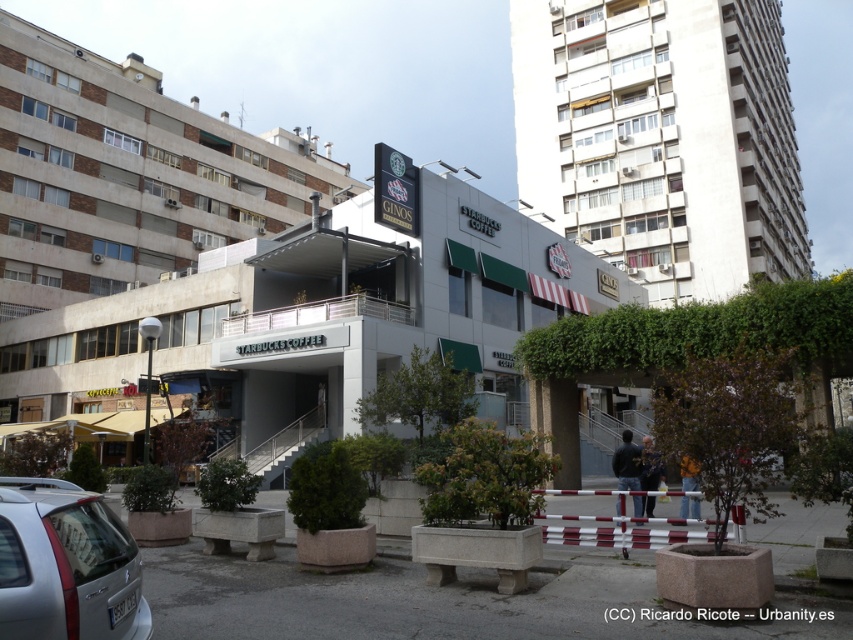
Is white concrete building at upper right thinner than silver metallic car at lower left?

No, white concrete building at upper right is not thinner than silver metallic car at lower left.

Does white concrete building at upper right appear under silver metallic car at lower left?

No, white concrete building at upper right is not below silver metallic car at lower left.

Is point (692, 106) closer to camera compared to point (129, 612)?

No, (692, 106) is further to viewer.

Where is `white concrete building at upper right`? white concrete building at upper right is located at coordinates (662, 138).

Does white concrete building at center have a greater width compared to silver metallic car at lower left?

Indeed, white concrete building at center has a greater width compared to silver metallic car at lower left.

Can you confirm if white concrete building at center is thinner than silver metallic car at lower left?

No.

Describe the element at coordinates (315, 321) in the screenshot. This screenshot has height=640, width=853. I see `white concrete building at center` at that location.

The width and height of the screenshot is (853, 640). What are the coordinates of `white concrete building at center` in the screenshot? It's located at (315, 321).

Who is more distant from viewer, (282, 253) or (749, 180)?

Positioned behind is point (749, 180).

From the picture: Is white concrete building at center thinner than white concrete building at upper right?

Yes, white concrete building at center is thinner than white concrete building at upper right.

Which is behind, point (138, 317) or point (757, 250)?

The point (757, 250) is more distant.

Find the location of a particular element. white concrete building at center is located at coordinates (315, 321).